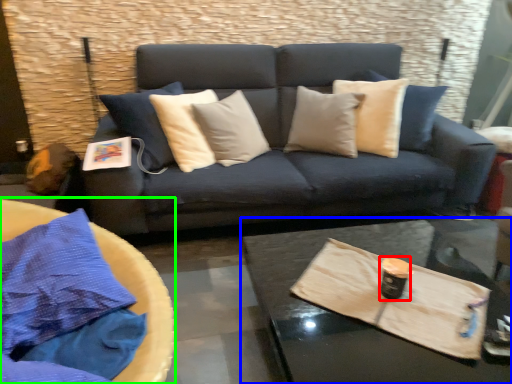
Question: Which object is the farthest from beverage (highlighted by a red box)? Choose among these: coffee table (highlighted by a blue box) or round table (highlighted by a green box).

Choices:
 (A) coffee table
 (B) round table

Answer: (B)